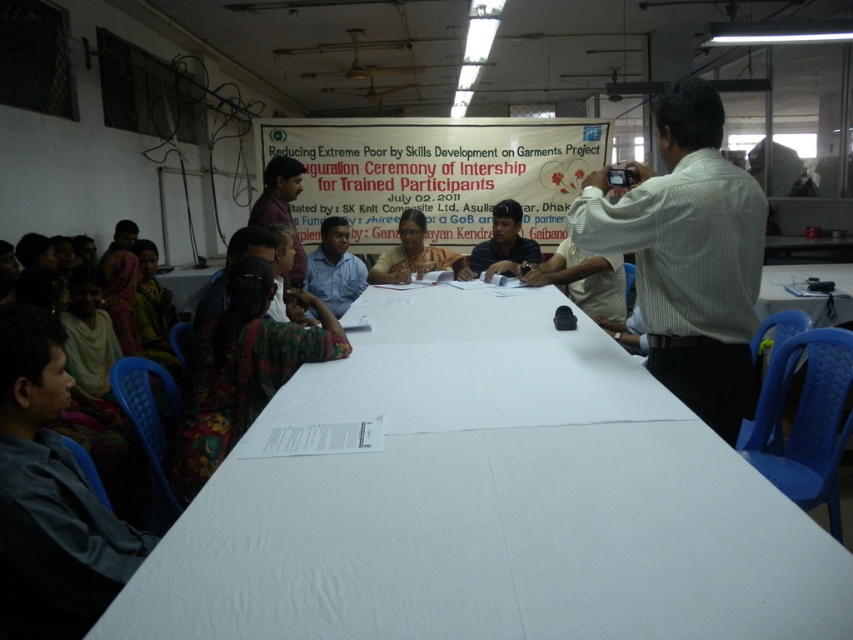
Question: Which object appears farthest from the camera in this image?

Choices:
 (A) white plastic table at center
 (B) matte black shirt at center
 (C) matte blue shirt at center

Answer: (C)

Question: From the image, what is the correct spatial relationship of matte black shirt at center in relation to dark brown shirt at center?

Choices:
 (A) above
 (B) below

Answer: (B)

Question: Which object is the farthest from the dark brown shirt at center?

Choices:
 (A) white plastic table at center
 (B) striped cotton shirt at upper right

Answer: (B)

Question: Can you confirm if matte black shirt at center is positioned above dark blue shirt at center?

Choices:
 (A) yes
 (B) no

Answer: (B)

Question: Does matte blue shirt at center have a greater width compared to dark brown shirt at center?

Choices:
 (A) no
 (B) yes

Answer: (B)

Question: Which point is farther from the camera taking this photo?

Choices:
 (A) (492, 253)
 (B) (664, 157)

Answer: (A)